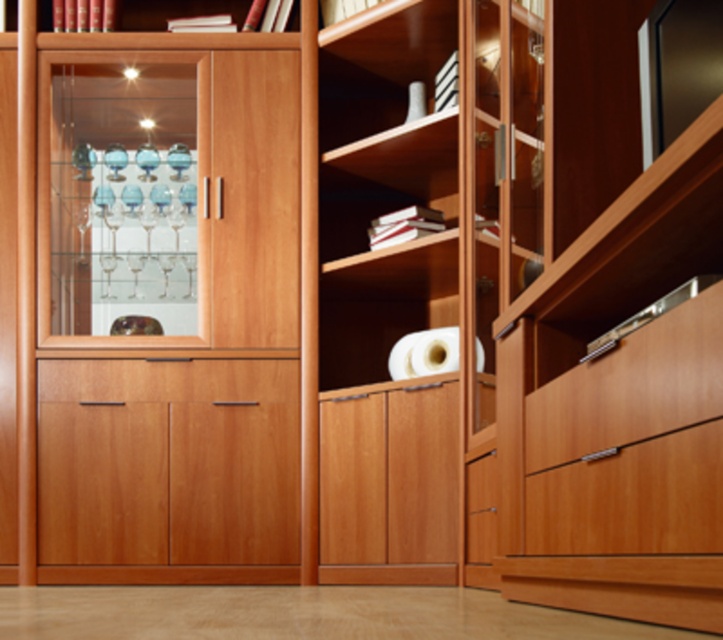
You are designing a layout for a kitchen and need to place a tall appliance that requires 1.8 meters of vertical space. You have two options in the cabinetry system shown. Which of the two objects, the wooden cabinet at center or the transparent glass cabinet at left, would be suitable for accommodating this appliance based on their heights?

The transparent glass cabinet at left has a greater height than the wooden cabinet at center, so it would be suitable for accommodating the tall appliance requiring 1.8 meters of vertical space.

You need to place a tall vase that is 1 meter in height. The transparent glass cabinet at left and the wooden drawer at lower right are potential storage spots. Which one can accommodate the vase based on their vertical space?

The transparent glass cabinet at left is above the wooden drawer at lower right, so it likely has more vertical space. Therefore, the transparent glass cabinet at left can accommodate the tall vase.

You are organizing the kitchen and need to place a tall vase that requires a flat surface. The wooden cabinet at center and the transparent glass cabinet at left are both available. Based on their positions, which one offers a higher surface for placing the vase?

The transparent glass cabinet at left offers a higher surface for placing the vase since the wooden cabinet at center is located below it.